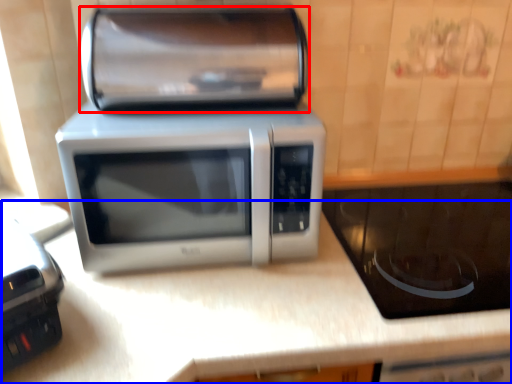
Question: Which object appears closest to the camera in this image, stereo (highlighted by a red box) or counter top (highlighted by a blue box)?

Choices:
 (A) stereo
 (B) counter top

Answer: (B)